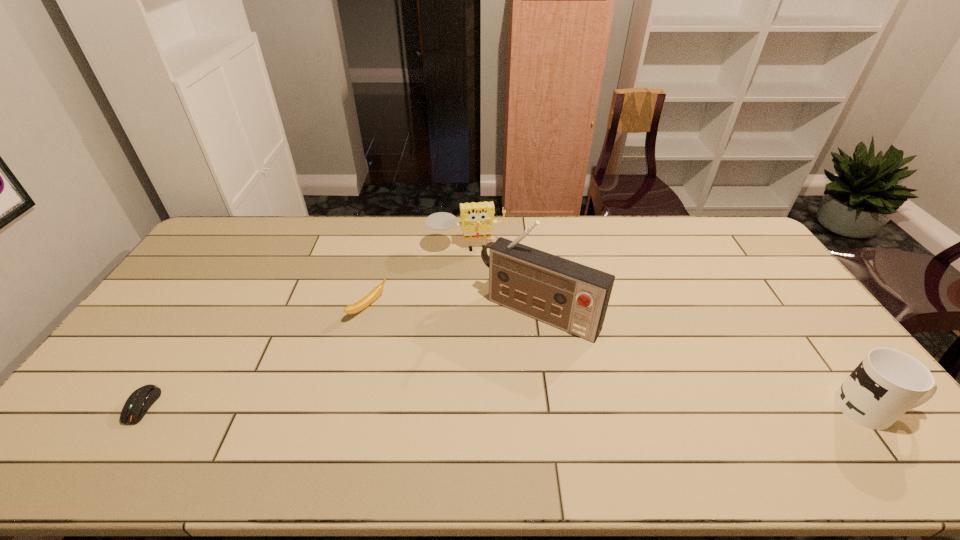
The height and width of the screenshot is (540, 960). I want to click on vacant position in the image that satisfies the following two spatial constraints: 1. on the button of the rightmost object; 2. on the handle side of the computer equipment, so click(141, 408).

I want to click on free spot that satisfies the following two spatial constraints: 1. on the back side of the second object from left to right; 2. on the left side of the sponge, so click(x=384, y=249).